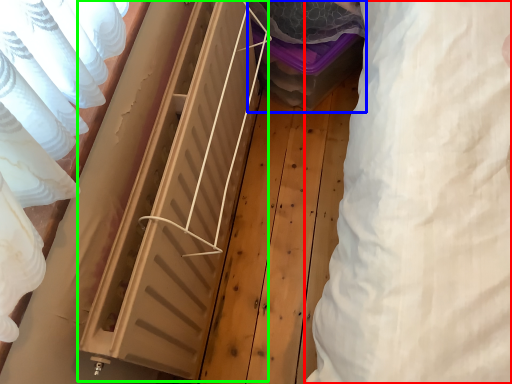
Question: Considering the real-world distances, which object is farthest from clothing (highlighted by a red box)? storage box (highlighted by a blue box) or radiator (highlighted by a green box)?

Choices:
 (A) storage box
 (B) radiator

Answer: (A)